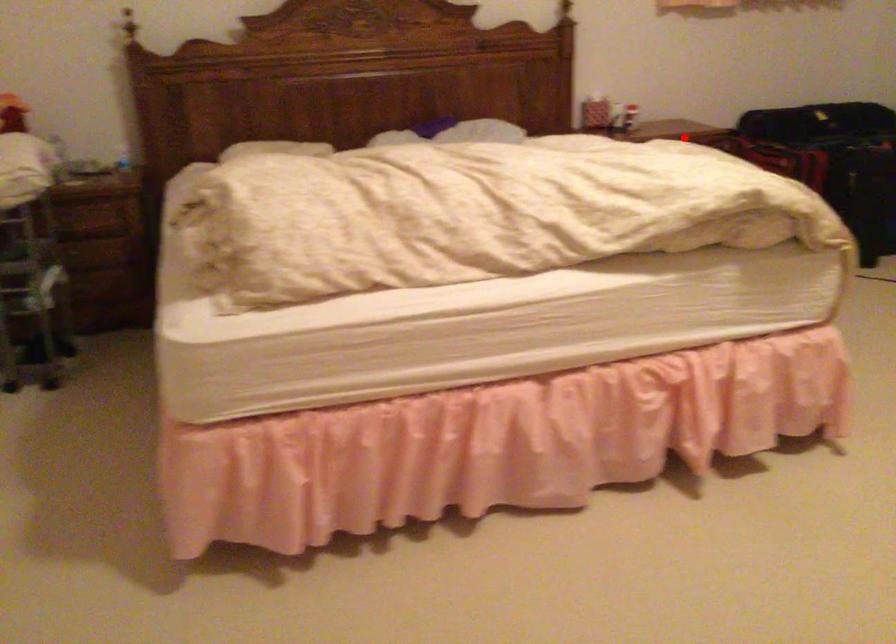
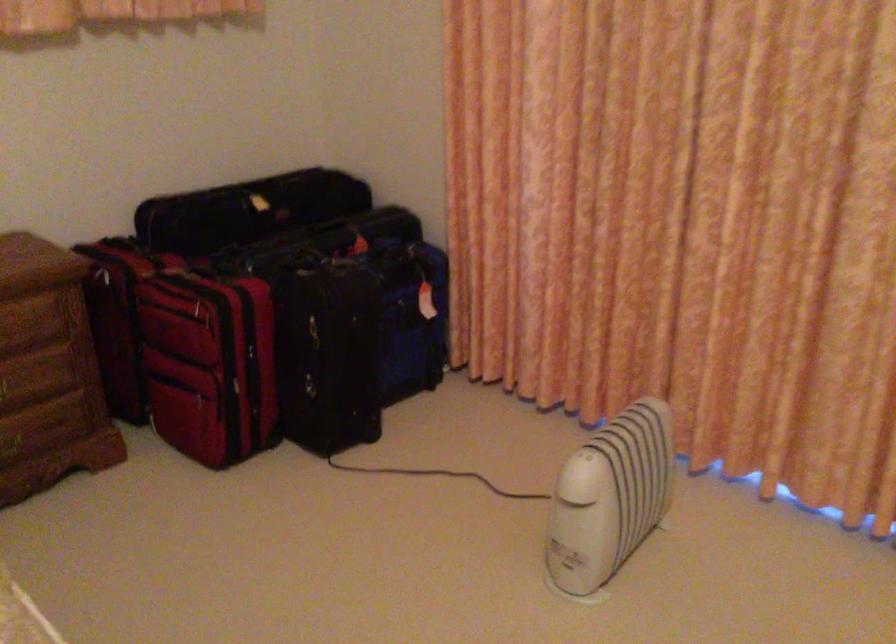
Question: I am providing you with two images of the same scene from different viewpoints. Given a red point in image1, look at the same physical point in image2. Is it:

Choices:
 (A) Closer to the viewpoint
 (B) Farther from the viewpoint

Answer: (A)